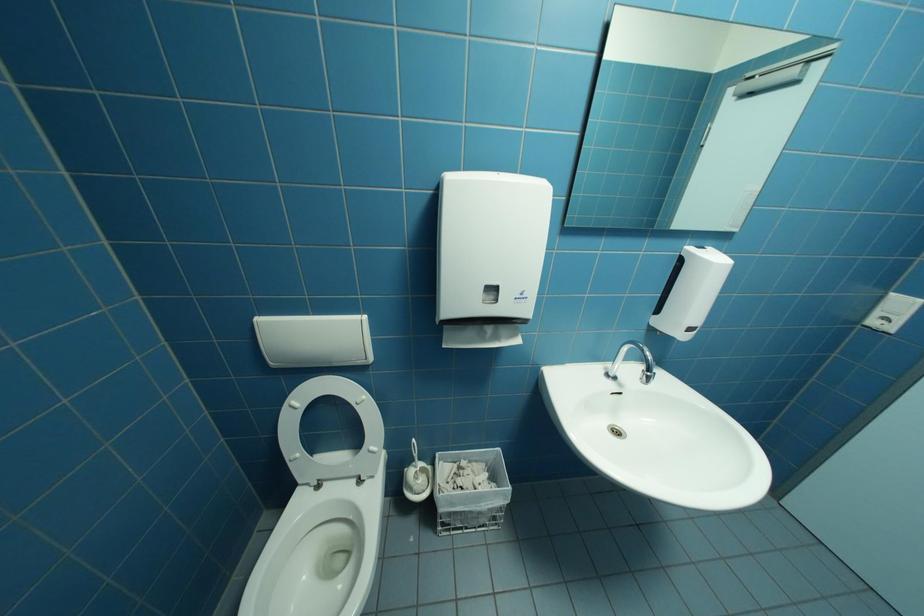
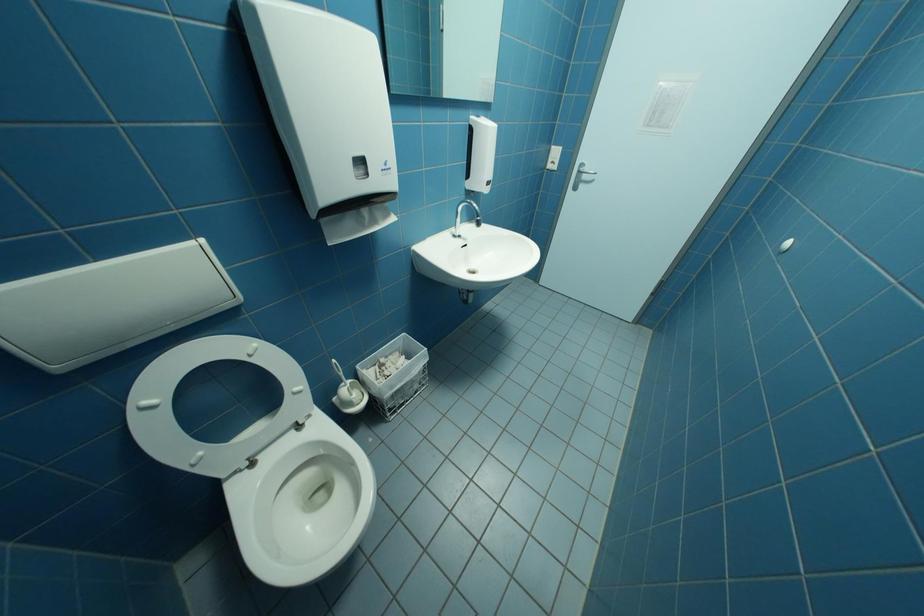
First-person continuous shooting, in which direction is the camera rotating?

The rotation direction of the camera is right-down.